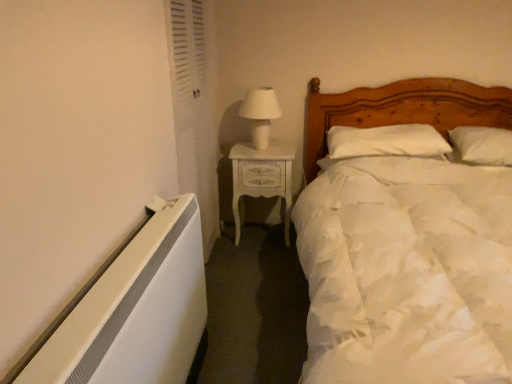
Question: Does white glossy table lamp at upper center appear on the left side of white soft pillow at upper right, the 1th pillow in the right-to-left sequence?

Choices:
 (A) no
 (B) yes

Answer: (B)

Question: Does white glossy table lamp at upper center have a lesser width compared to white soft pillow at upper right, the 1th pillow in the right-to-left sequence?

Choices:
 (A) no
 (B) yes

Answer: (B)

Question: Is white glossy table lamp at upper center positioned beyond the bounds of white soft pillow at upper right, which is the second pillow in left-to-right order?

Choices:
 (A) no
 (B) yes

Answer: (B)

Question: Is white glossy table lamp at upper center bigger than white soft pillow at upper right, the 1th pillow in the right-to-left sequence?

Choices:
 (A) yes
 (B) no

Answer: (B)

Question: From the image's perspective, is white glossy table lamp at upper center over white soft pillow at upper right, which is the second pillow in left-to-right order?

Choices:
 (A) no
 (B) yes

Answer: (B)

Question: Does point (312, 124) appear closer or farther from the camera than point (189, 117)?

Choices:
 (A) farther
 (B) closer

Answer: (A)

Question: From a real-world perspective, is white soft bed at right physically located above or below white louvered door at left?

Choices:
 (A) above
 (B) below

Answer: (B)

Question: Considering the relative positions of white soft bed at right and white louvered door at left in the image provided, is white soft bed at right to the left or to the right of white louvered door at left?

Choices:
 (A) right
 (B) left

Answer: (A)

Question: From the image's perspective, relative to white louvered door at left, is white soft bed at right above or below?

Choices:
 (A) below
 (B) above

Answer: (A)

Question: Considering the positions of white soft bed at right and white soft pillow at center, which is counted as the second pillow, starting from the right, in the image, is white soft bed at right taller or shorter than white soft pillow at center, which is counted as the second pillow, starting from the right,?

Choices:
 (A) short
 (B) tall

Answer: (B)

Question: Is point (359, 109) positioned closer to the camera than point (429, 127)?

Choices:
 (A) closer
 (B) farther

Answer: (B)

Question: Based on their positions, is white soft bed at right located to the left or right of white soft pillow at center, which is counted as the second pillow, starting from the right?

Choices:
 (A) right
 (B) left

Answer: (A)

Question: Is white soft bed at right wider or thinner than white soft pillow at center, which is the 1th pillow in left-to-right order?

Choices:
 (A) thin
 (B) wide

Answer: (B)

Question: Considering the positions of white soft pillow at upper right, the 1th pillow in the right-to-left sequence, and white painted wood nightstand at center in the image, is white soft pillow at upper right, the 1th pillow in the right-to-left sequence, taller or shorter than white painted wood nightstand at center?

Choices:
 (A) short
 (B) tall

Answer: (A)

Question: Is point (452, 145) closer or farther from the camera than point (246, 155)?

Choices:
 (A) farther
 (B) closer

Answer: (A)